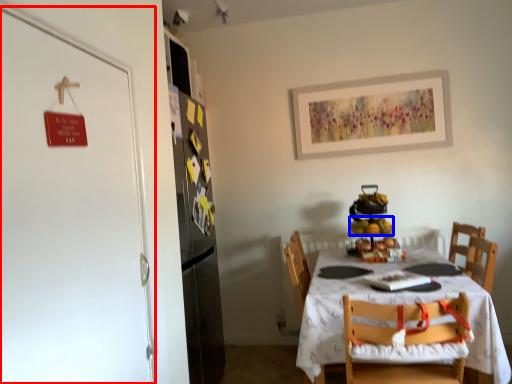
Question: Which of the following is the farthest to the observer, door (highlighted by a red box) or fruit (highlighted by a blue box)?

Choices:
 (A) door
 (B) fruit

Answer: (B)